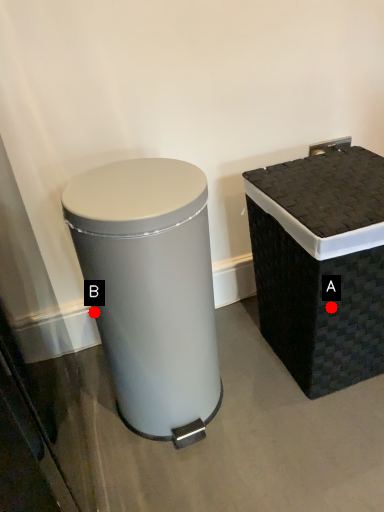
Question: Two points are circled on the image, labeled by A and B beside each circle. Which point is closer to the camera?

Choices:
 (A) A is closer
 (B) B is closer

Answer: (B)